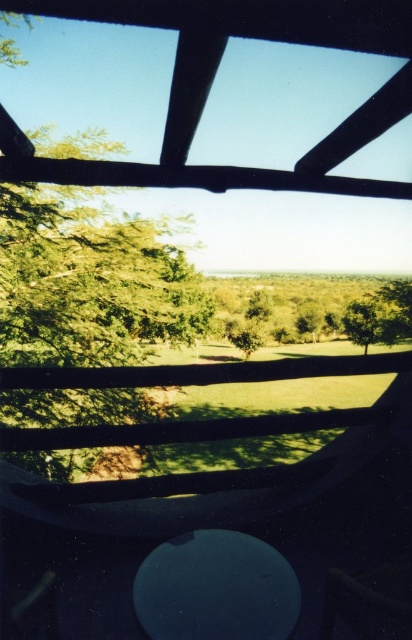
Question: Does green leafy tree at center have a lesser width compared to green leafy tree at lower right?

Choices:
 (A) yes
 (B) no

Answer: (A)

Question: Which point appears closest to the camera in this image?

Choices:
 (A) (395, 304)
 (B) (351, 317)

Answer: (A)

Question: From the image, what is the correct spatial relationship of green leafy tree at center in relation to green leafy tree at lower right?

Choices:
 (A) right
 (B) left

Answer: (B)

Question: Does green leafy tree at center appear on the left side of green leafy tree at lower right?

Choices:
 (A) no
 (B) yes

Answer: (B)

Question: Which point is farther from the camera taking this photo?

Choices:
 (A) (56, 305)
 (B) (402, 314)

Answer: (B)

Question: Which point is closer to the camera?

Choices:
 (A) (398, 339)
 (B) (32, 228)

Answer: (B)